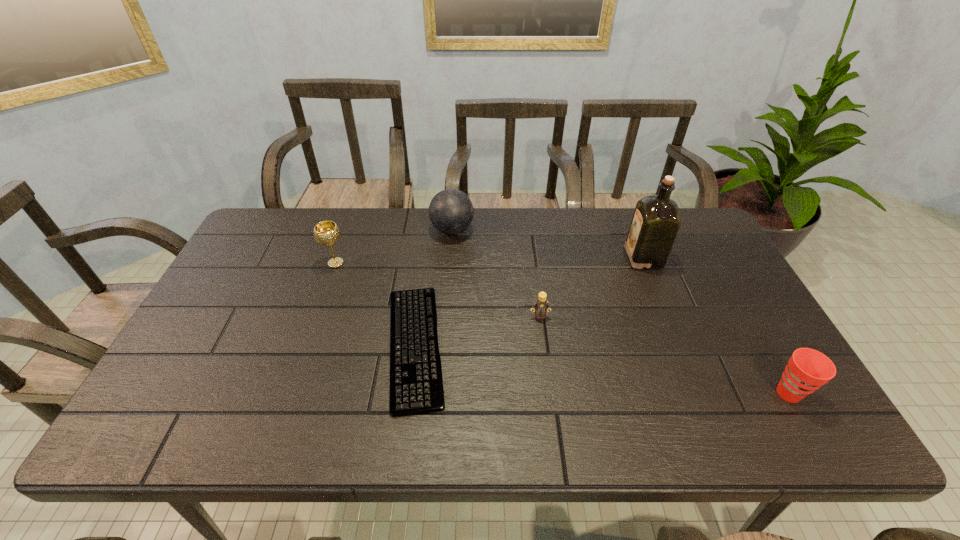
This screenshot has height=540, width=960. I want to click on liquor, so click(656, 220).

Where is `the tallest object`? The image size is (960, 540). the tallest object is located at coordinates (656, 220).

Identify the location of bowling ball. Image resolution: width=960 pixels, height=540 pixels. (451, 211).

Locate an element on the screen. chalice is located at coordinates (326, 233).

At what (x,y) coordinates should I click in order to perform the action: click on cup. Please return your answer as a coordinate pair (x, y). The height and width of the screenshot is (540, 960). Looking at the image, I should click on (807, 370).

Find the location of a particular element. the fourth tallest object is located at coordinates (807, 370).

Where is `the third object from right to left`? This screenshot has height=540, width=960. the third object from right to left is located at coordinates (541, 305).

This screenshot has height=540, width=960. Identify the location of the second shortest object. [x=541, y=305].

Image resolution: width=960 pixels, height=540 pixels. I want to click on the shortest object, so click(x=416, y=384).

Find the location of `free space located 0.050m on the label of the liquor`. free space located 0.050m on the label of the liquor is located at coordinates [x=612, y=258].